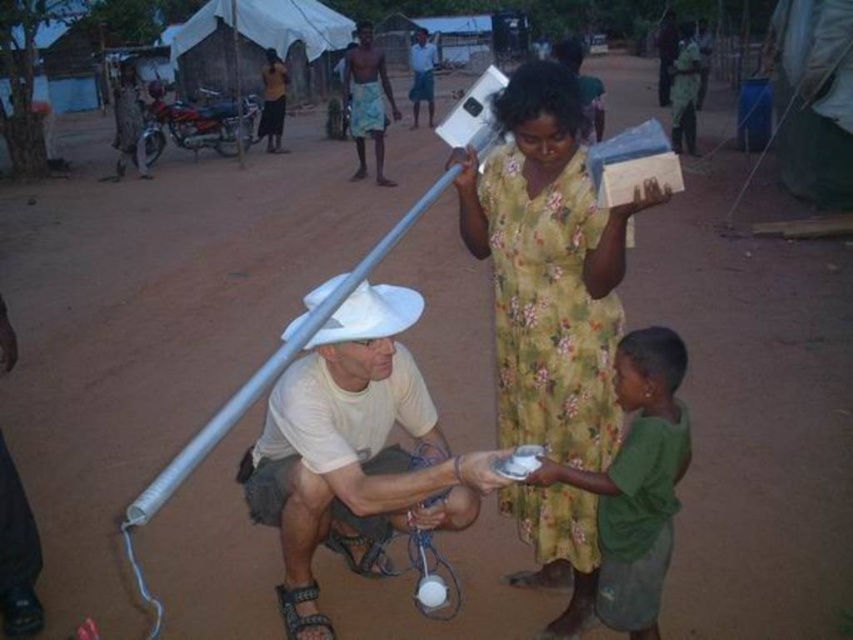
Question: Which is nearer to the white matte hat at center?

Choices:
 (A) light brown woven cloth at center
 (B) black fabric sandal at lower center
 (C) floral cotton dress at center
 (D) green cotton shirt at lower right

Answer: (B)

Question: In this image, where is floral cotton dress at center located relative to green cotton shirt at lower right?

Choices:
 (A) left
 (B) right

Answer: (A)

Question: Considering the real-world distances, which object is farthest from the white matte hat at center?

Choices:
 (A) green cotton shirt at lower right
 (B) light brown woven cloth at center
 (C) black fabric sandal at lower center
 (D) floral cotton dress at center

Answer: (B)

Question: Which point is farther to the camera?

Choices:
 (A) black fabric sandal at lower center
 (B) light brown woven cloth at center

Answer: (B)

Question: Is floral cotton dress at center thinner than green cotton shirt at lower right?

Choices:
 (A) no
 (B) yes

Answer: (B)

Question: Can you confirm if floral cotton dress at center is positioned below green cotton shirt at lower right?

Choices:
 (A) no
 (B) yes

Answer: (A)